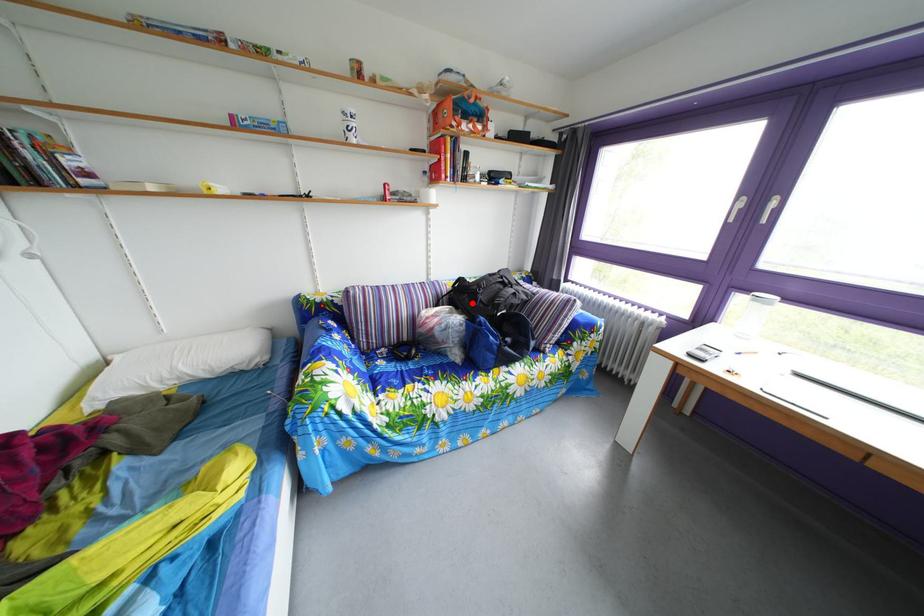
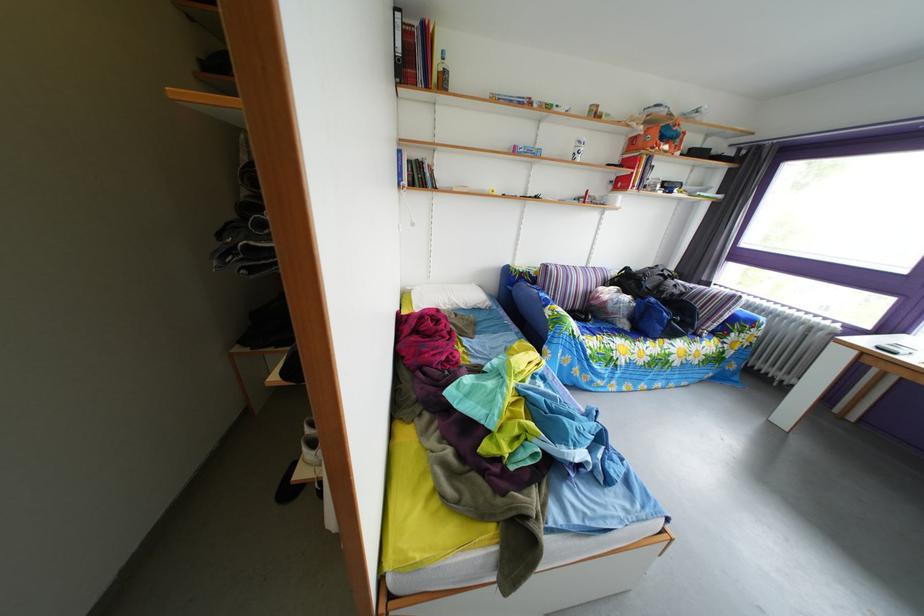
Find the pixel in the second image that matches the highlighted location in the first image.

(638, 289)